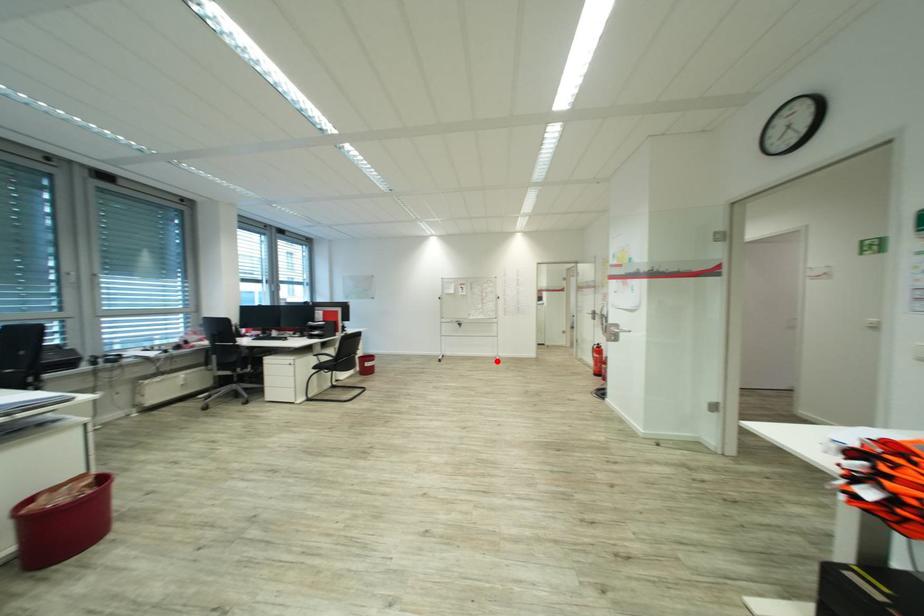
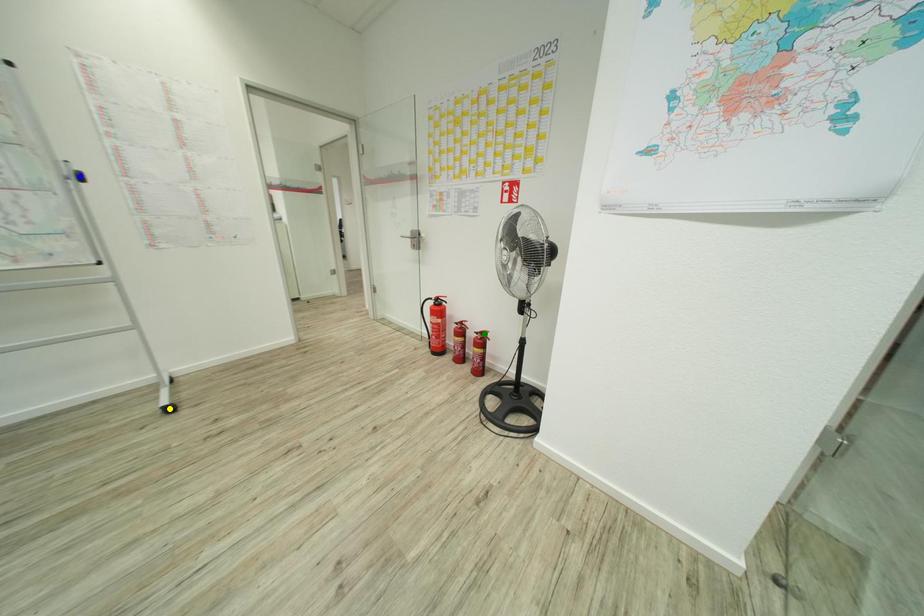
Question: I am providing you with two images of the same scene from different viewpoints. A red point is marked on the first image. You are given multiple points on the second image. Which mark in image 2 goes with the point in image 1?

Choices:
 (A) green point
 (B) yellow point
 (C) blue point

Answer: (B)